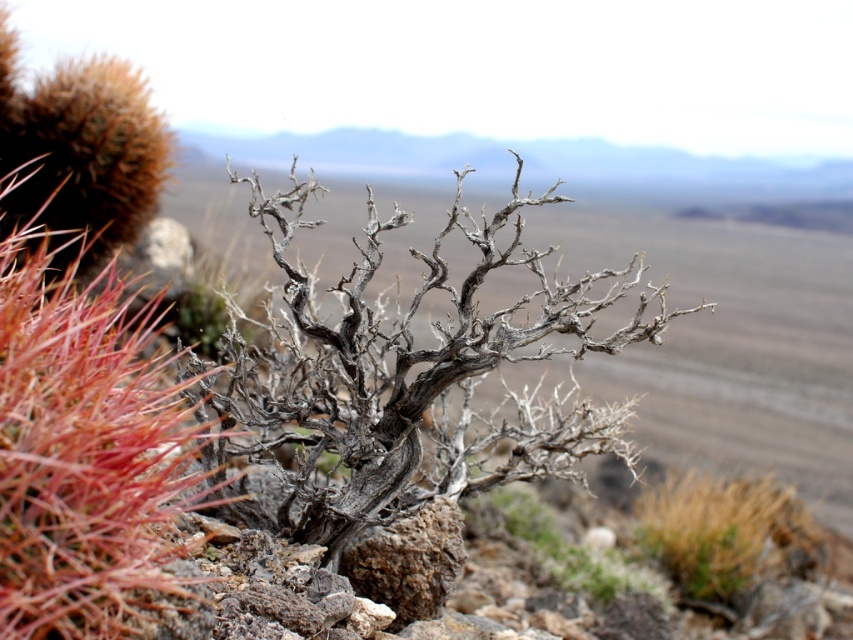
You are a desert explorer who needs to navigate between the red spiky cactus at left and the brown textured grass at lower right. Which object is wider, and how might this affect your path?

The brown textured grass at lower right is wider than the red spiky cactus at left. Since the grass is wider, you might need to adjust your path to avoid stepping on it or ensure there is enough space to pass safely.

You are a desert explorer who needs to navigate between the red spiky cactus at left and the brown textured grass at lower right. Which direction should you move to go from the cactus to the grass?

To move from the red spiky cactus at left to the brown textured grass at lower right, you should move to the right since the cactus is positioned to the left of the grass.